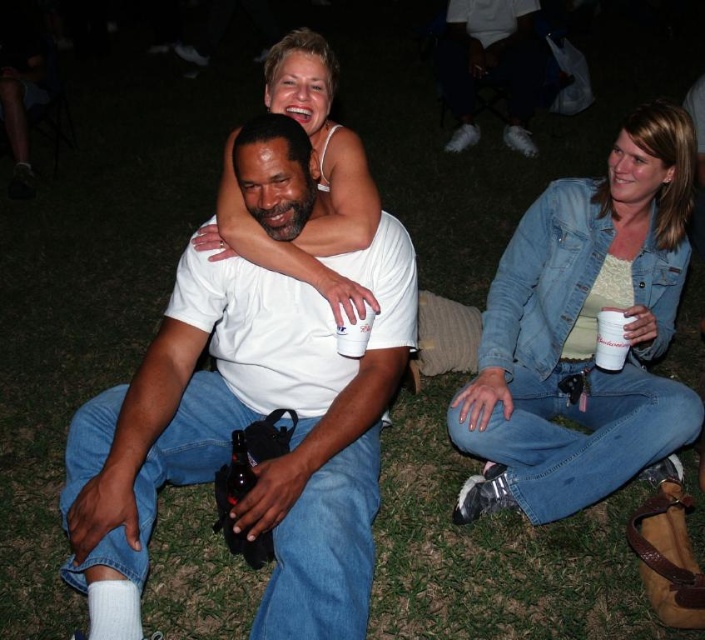
Question: Which object appears farthest from the camera in this image?

Choices:
 (A) white paper cup at center
 (B) denim jacket at lower right
 (C) white matte t-shirt at center
 (D) white plastic cup at lower right

Answer: (D)

Question: Is white matte t-shirt at center smaller than white paper cup at center?

Choices:
 (A) no
 (B) yes

Answer: (A)

Question: Does white matte t-shirt at center appear on the right side of denim jacket at lower right?

Choices:
 (A) no
 (B) yes

Answer: (A)

Question: Which point appears farthest from the camera in this image?

Choices:
 (A) (345, 538)
 (B) (613, 330)

Answer: (B)

Question: Is white plastic cup at lower right positioned behind white paper cup at center?

Choices:
 (A) no
 (B) yes

Answer: (B)

Question: Which point is closer to the camera taking this photo?

Choices:
 (A) (596, 321)
 (B) (367, 586)
 (C) (534, 209)
 (D) (357, 342)

Answer: (B)